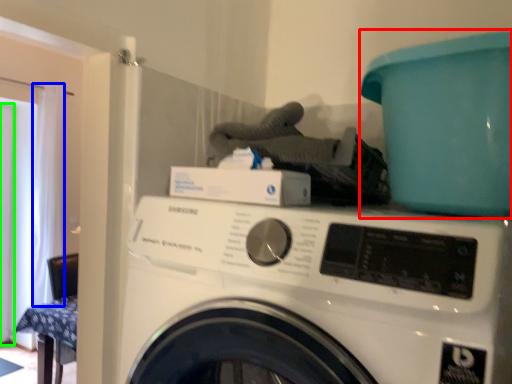
Question: Which is farther away from teal (highlighted by a red box)? curtain (highlighted by a blue box) or screen door (highlighted by a green box)?

Choices:
 (A) curtain
 (B) screen door

Answer: (B)